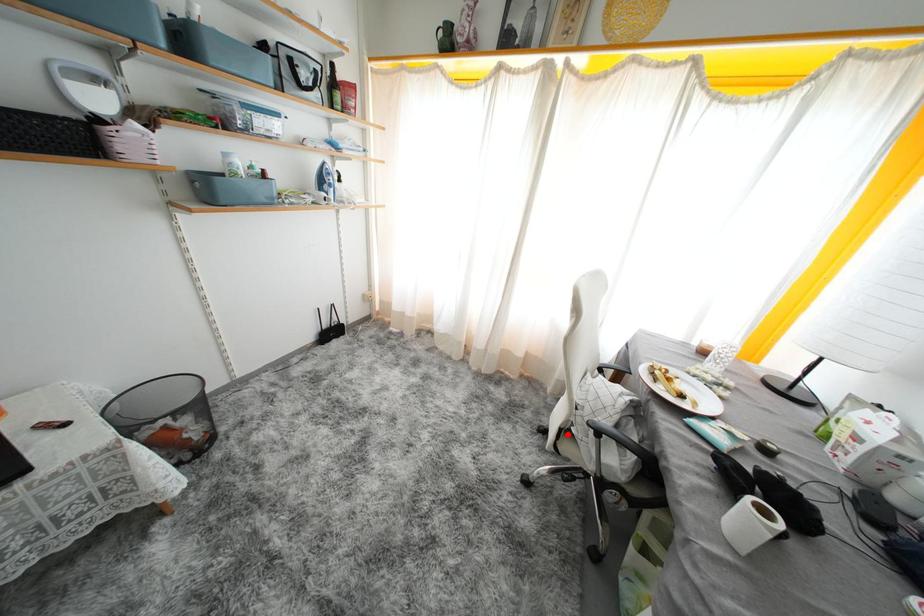
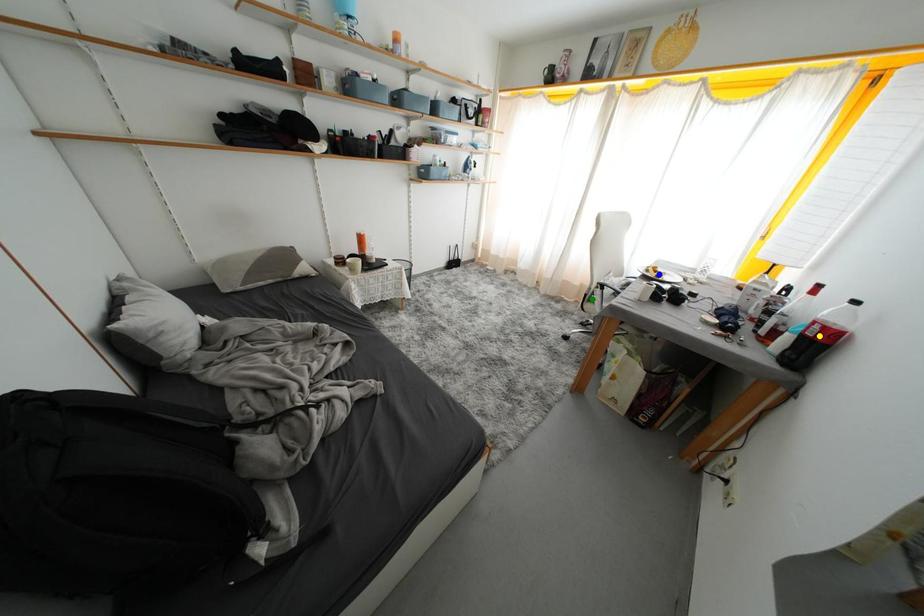
Question: I am providing you with two images of the same scene from different viewpoints. A red point is marked on the first image. You are given multiple points on the second image. Can you choose the point in image 2 that corresponds to the point in image 1?

Choices:
 (A) yellow point
 (B) green point
 (C) blue point

Answer: (B)